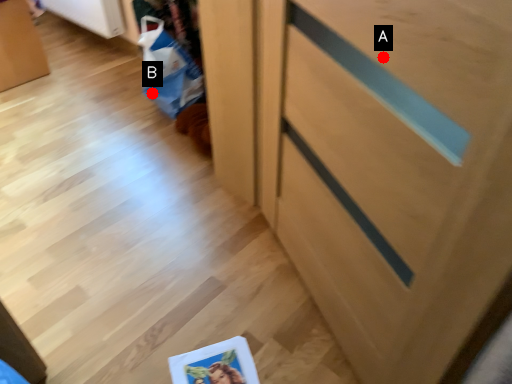
Question: Two points are circled on the image, labeled by A and B beside each circle. Among these points, which one is farthest from the camera?

Choices:
 (A) A is further
 (B) B is further

Answer: (B)